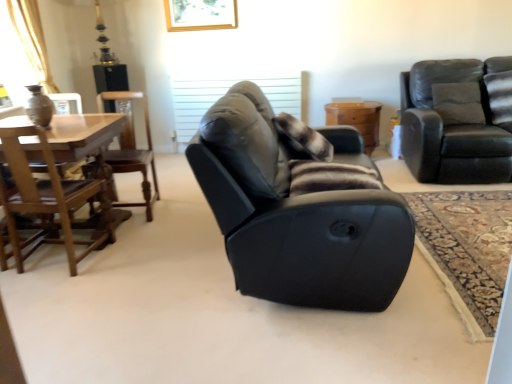
Where is `free spot in front of wooden chair at left, the 4th chair from the right`? Image resolution: width=512 pixels, height=384 pixels. free spot in front of wooden chair at left, the 4th chair from the right is located at coordinates pos(52,289).